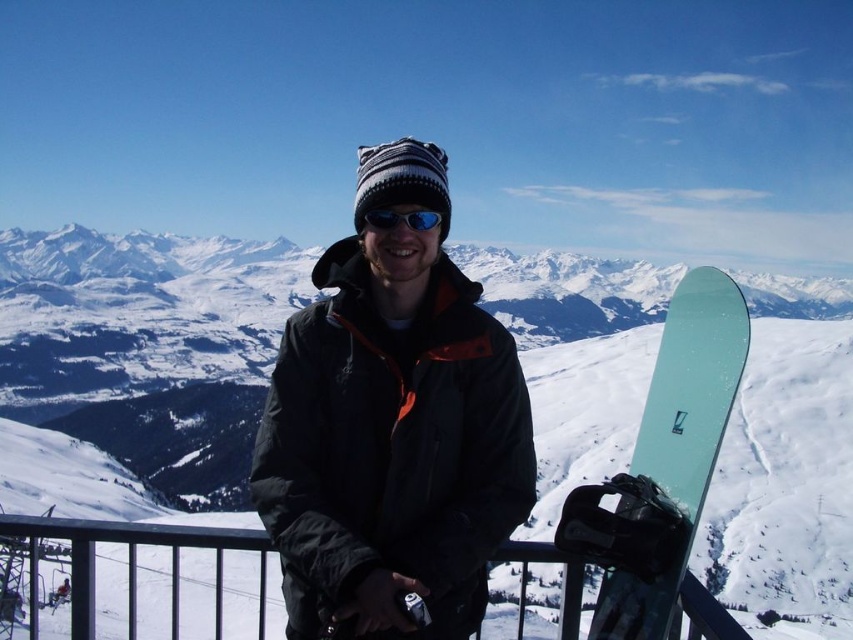
Question: Estimate the real-world distances between objects in this image. Which object is closer to the sunglasses at center?

Choices:
 (A) black matte jacket at center
 (B) metallic black fence at lower left
 (C) white matte snowboard at center
 (D) translucent teal snowboard at lower right

Answer: (A)

Question: Which object appears closest to the camera in this image?

Choices:
 (A) metallic black fence at lower left
 (B) black matte jacket at center
 (C) sunglasses at center
 (D) white matte snowboard at center

Answer: (A)

Question: Can you confirm if black matte jacket at center is wider than metallic black fence at lower left?

Choices:
 (A) yes
 (B) no

Answer: (B)

Question: Can you confirm if black matte jacket at center is smaller than translucent teal snowboard at lower right?

Choices:
 (A) yes
 (B) no

Answer: (B)

Question: Which point is farther from the camera taking this photo?

Choices:
 (A) 701,374
 (B) 569,426
 (C) 711,627
 (D) 412,211

Answer: (B)

Question: Does white matte snowboard at center come behind sunglasses at center?

Choices:
 (A) no
 (B) yes

Answer: (B)